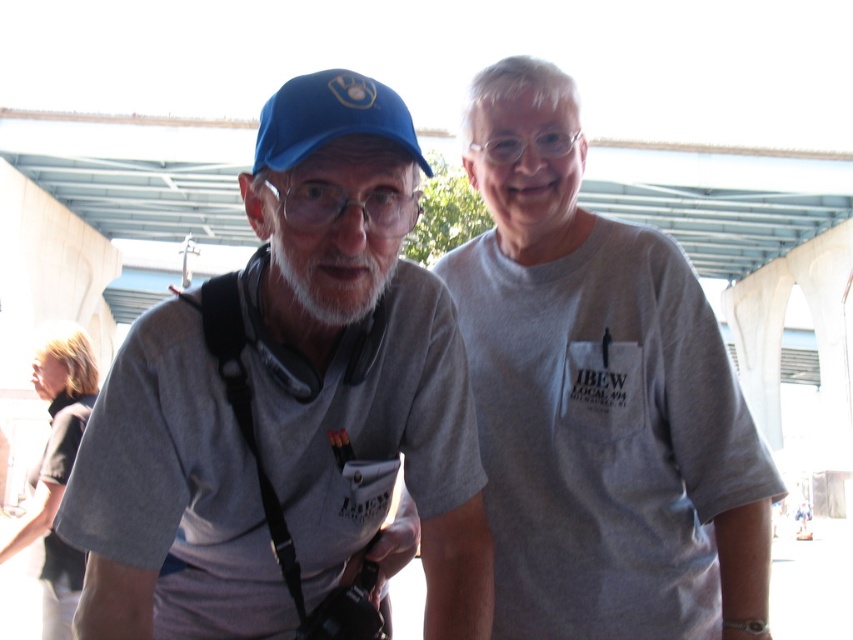
You are a photographer trying to capture a group photo of two people. You notice the dark gray shirt at lower left and the whitehairbeard at center. Which person should you position closer to the camera to ensure both appear equally wide in the photo?

Since the dark gray shirt at lower left has a lesser width compared to whitehairbeard at center, you should position the dark gray shirt at lower left closer to the camera so that both appear equally wide in the photo.

You are a photographer standing at the point marked by the coordinate point (358, 352). You need to capture a photo of the person wearing a light gray T shirt with IBEW Local 494 printed on the chest pocket. Can you see them clearly from your current position?

The point (358, 352) marks the matte gray t shirt at left. Since the photographer is positioned at the point marking the left individual, they are facing away from the person on the right wearing the light gray T shirt with IBEW Local 494. Therefore, the photographer cannot see them clearly from this position.